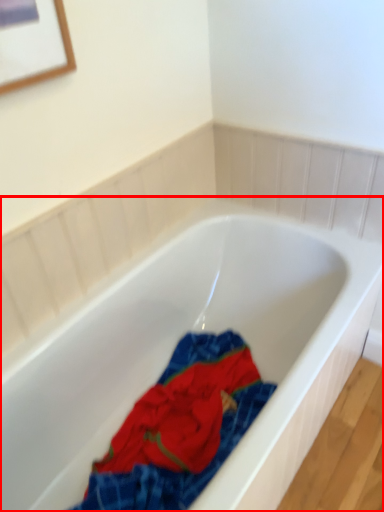
Question: Where is bathtub (annotated by the red box) located in relation to material in the image?

Choices:
 (A) left
 (B) right

Answer: (B)